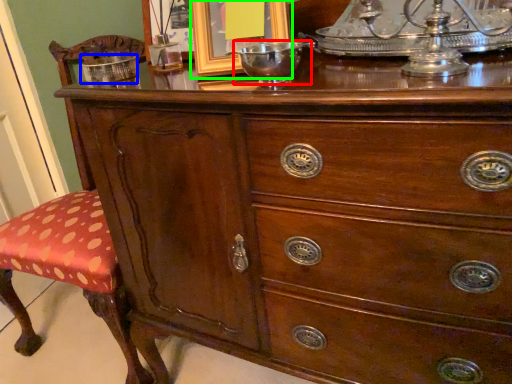
Question: Estimate the real-world distances between objects in this image. Which object is closer to glass bowl (highlighted by a red box), bowl (highlighted by a blue box) or picture frame (highlighted by a green box)?

Choices:
 (A) bowl
 (B) picture frame

Answer: (B)